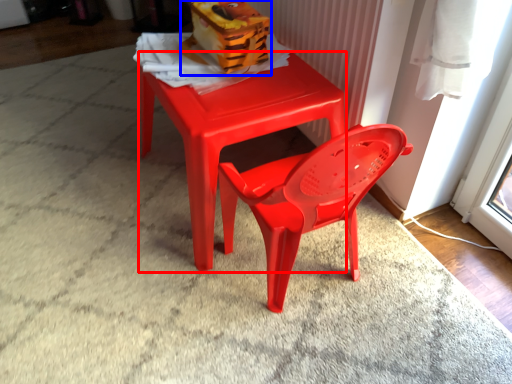
Question: Which point is closer to the camera, table (highlighted by a red box) or toy (highlighted by a blue box)?

Choices:
 (A) table
 (B) toy

Answer: (A)